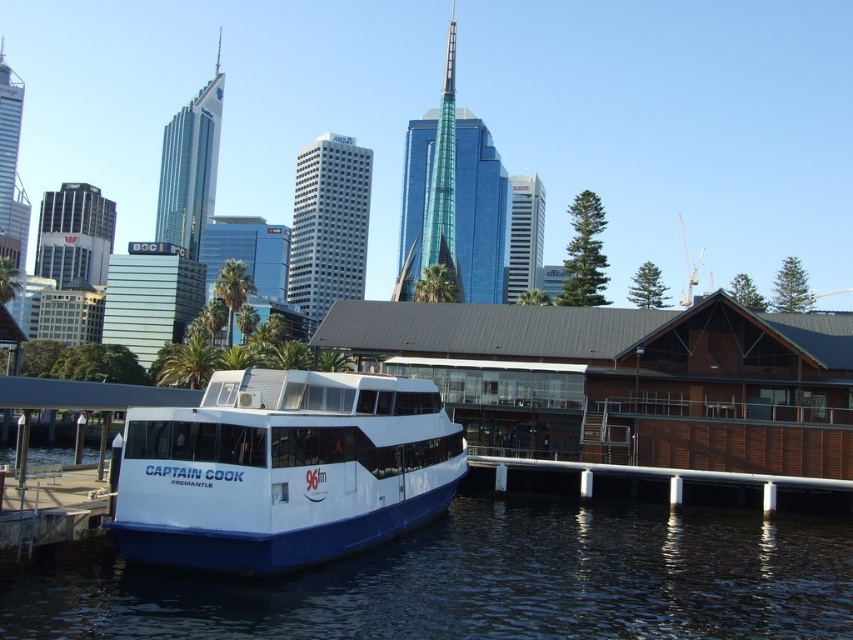
Is point (479, 525) in front of point (379, 429)?

No, (479, 525) is behind (379, 429).

Does transparent blue water at lower center appear under white glossy boat at center?

Yes.

Between point (131, 630) and point (281, 560), which one is positioned behind?

The point (281, 560) is more distant.

Find the location of a particular element. The width and height of the screenshot is (853, 640). transparent blue water at lower center is located at coordinates (486, 582).